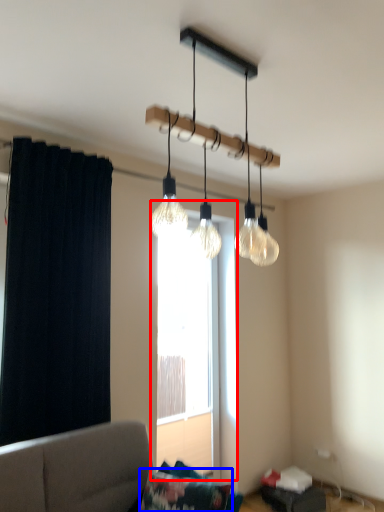
Question: Which object appears closest to the camera in this image, window (highlighted by a red box) or pillow (highlighted by a blue box)?

Choices:
 (A) window
 (B) pillow

Answer: (B)